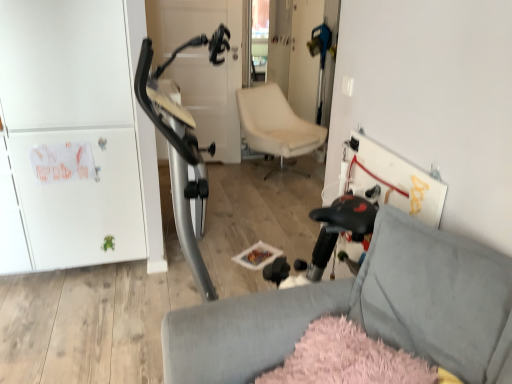
Question: Can you confirm if soft gray fabric chair at lower right, which is the second chair from top to bottom, is taller than beige leather chair at center, the second chair in the bottom-to-top sequence?

Choices:
 (A) no
 (B) yes

Answer: (A)

Question: Can you confirm if soft gray fabric chair at lower right, the 1th chair from the bottom, is positioned to the left of beige leather chair at center, arranged as the 1th chair when viewed from the back?

Choices:
 (A) no
 (B) yes

Answer: (B)

Question: Is soft gray fabric chair at lower right, which appears as the second chair when viewed from the back, not inside beige leather chair at center, arranged as the 1th chair when viewed from the back?

Choices:
 (A) no
 (B) yes

Answer: (B)

Question: Can you confirm if soft gray fabric chair at lower right, which is the first chair in front-to-back order, is positioned to the right of beige leather chair at center, the second chair in the bottom-to-top sequence?

Choices:
 (A) no
 (B) yes

Answer: (A)

Question: Considering the relative positions of soft gray fabric chair at lower right, the 1th chair from the bottom, and beige leather chair at center, the second chair in the bottom-to-top sequence, in the image provided, is soft gray fabric chair at lower right, the 1th chair from the bottom, behind beige leather chair at center, the second chair in the bottom-to-top sequence,?

Choices:
 (A) no
 (B) yes

Answer: (A)

Question: From a real-world perspective, is soft gray fabric chair at lower right, which is the second chair from top to bottom, physically above beige leather chair at center, the second chair in the bottom-to-top sequence?

Choices:
 (A) no
 (B) yes

Answer: (B)

Question: Can you confirm if soft gray fabric chair at lower right, the 1th chair from the bottom, is bigger than white matte cabinet at left?

Choices:
 (A) no
 (B) yes

Answer: (A)

Question: From a real-world perspective, is soft gray fabric chair at lower right, which is the second chair from top to bottom, located higher than white matte cabinet at left?

Choices:
 (A) no
 (B) yes

Answer: (A)

Question: Considering the relative positions of soft gray fabric chair at lower right, which is the second chair from top to bottom, and white matte cabinet at left in the image provided, is soft gray fabric chair at lower right, which is the second chair from top to bottom, to the left of white matte cabinet at left from the viewer's perspective?

Choices:
 (A) yes
 (B) no

Answer: (B)

Question: Is soft gray fabric chair at lower right, the 1th chair from the bottom, not close to white matte cabinet at left?

Choices:
 (A) no
 (B) yes

Answer: (B)

Question: From the image's perspective, is soft gray fabric chair at lower right, the 1th chair from the bottom, located above white matte cabinet at left?

Choices:
 (A) no
 (B) yes

Answer: (A)

Question: Considering the relative sizes of soft gray fabric chair at lower right, which is the second chair from top to bottom, and white matte cabinet at left in the image provided, is soft gray fabric chair at lower right, which is the second chair from top to bottom, shorter than white matte cabinet at left?

Choices:
 (A) no
 (B) yes

Answer: (B)

Question: Can you confirm if beige leather chair at center, marked as the second chair in a front-to-back arrangement, is smaller than white matte cabinet at left?

Choices:
 (A) no
 (B) yes

Answer: (B)